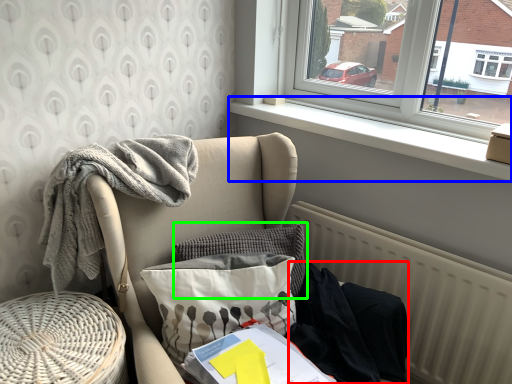
Question: Which object is positioned farthest from clothing (highlighted by a red box)? Select from window sill (highlighted by a blue box) and pillow (highlighted by a green box).

Choices:
 (A) window sill
 (B) pillow

Answer: (A)